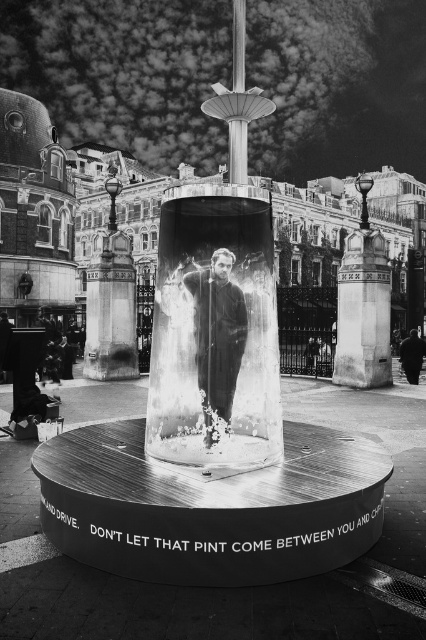
You are a fashion designer analyzing the public art installation. You notice the smooth black suit at center and the dark fabric jacket at lower right. Which piece of clothing is positioned to the left of the other?

The smooth black suit at center is positioned to the left of the dark fabric jacket at lower right.